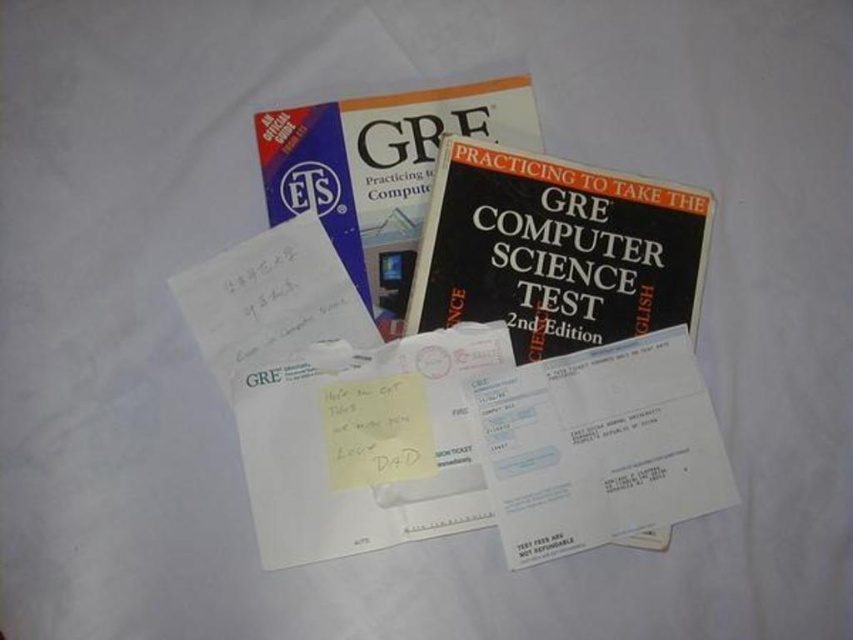
In order to click on hardcover book at center in this screenshot , I will do (x=381, y=172).

Is point (408, 170) in front of point (396, 394)?

No.

At what (x,y) coordinates should I click in order to perform the action: click on hardcover book at center. Please return your answer as a coordinate pair (x, y). Looking at the image, I should click on (381, 172).

Between black matte book at center and yellow paper at center, which one is positioned higher?

black matte book at center

Between black matte book at center and yellow paper at center, which one appears on the right side from the viewer's perspective?

From the viewer's perspective, black matte book at center appears more on the right side.

Which is in front, point (438, 301) or point (392, 410)?

Point (392, 410)

Identify the location of black matte book at center. The image size is (853, 640). (554, 250).

Is black matte book at center smaller than hardcover book at center?

Yes, black matte book at center is smaller than hardcover book at center.

Does black matte book at center lie in front of hardcover book at center?

Yes, it is in front of hardcover book at center.

The height and width of the screenshot is (640, 853). Describe the element at coordinates (554, 250) in the screenshot. I see `black matte book at center` at that location.

Find the location of a particular element. The image size is (853, 640). black matte book at center is located at coordinates (554, 250).